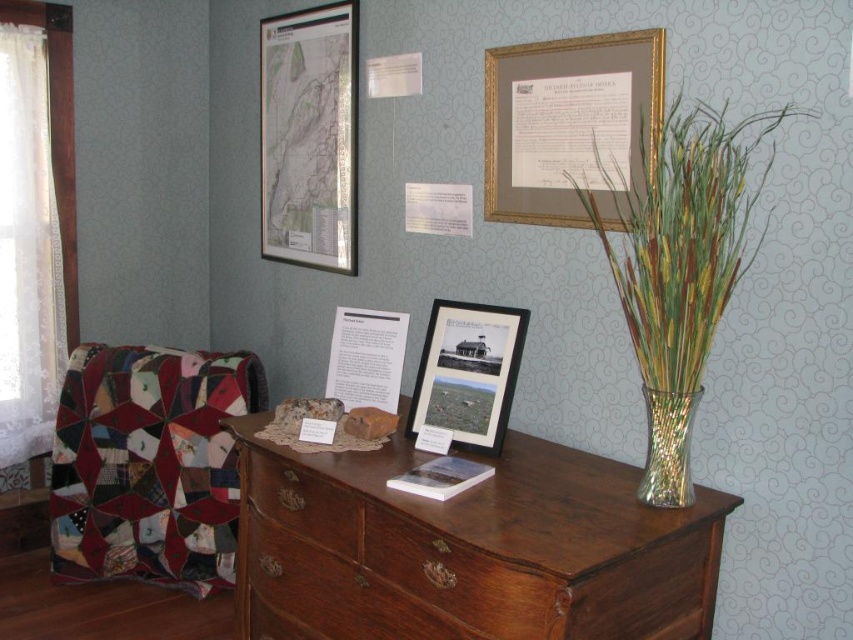
Question: Which object is closer to the camera taking this photo?

Choices:
 (A) matte wooden picture frame at center
 (B) wooden drawer at center
 (C) metallic vase at right
 (D) brown wood drawer at center

Answer: (C)

Question: Can you confirm if wooden dresser at center is positioned above matte paper map at upper left?

Choices:
 (A) no
 (B) yes

Answer: (A)

Question: Is metallic vase at right closer to the viewer compared to brown wood drawer at center?

Choices:
 (A) no
 (B) yes

Answer: (B)

Question: Among these objects, which one is nearest to the camera?

Choices:
 (A) brown wood drawer at center
 (B) wooden dresser at center
 (C) metallic vase at right
 (D) patchwork fabric quilt at left

Answer: (B)

Question: Does gold/gilded picture frame at upper center appear under matte wooden picture frame at center?

Choices:
 (A) no
 (B) yes

Answer: (A)

Question: Which of the following is the farthest from the observer?

Choices:
 (A) wooden dresser at center
 (B) translucent glass vase at right
 (C) wooden drawer at center

Answer: (B)